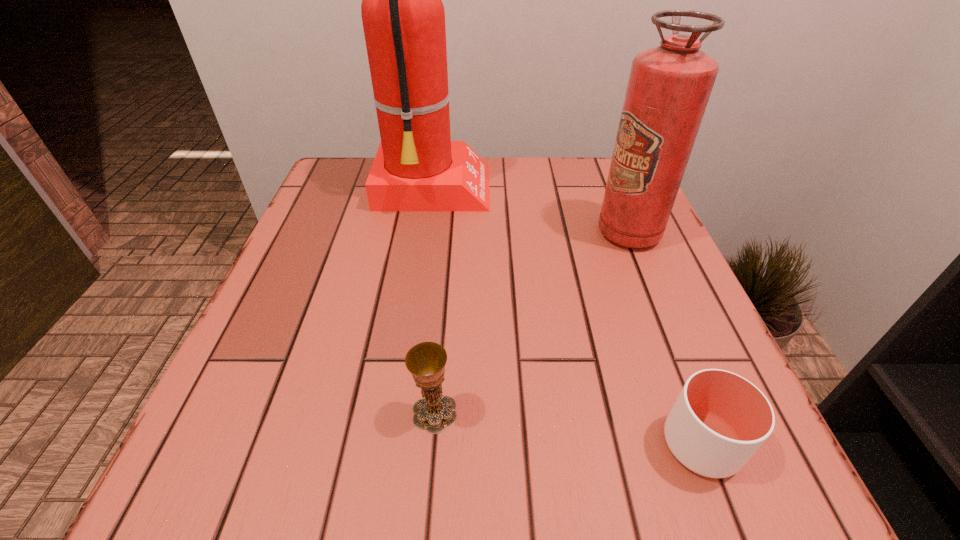
Where is `empty space between the taller fire extinguisher and the cup`? The image size is (960, 540). empty space between the taller fire extinguisher and the cup is located at coordinates (567, 318).

Identify the location of vacant region between the second tallest object and the third tallest object. The image size is (960, 540). (532, 322).

The width and height of the screenshot is (960, 540). I want to click on empty location between the third shortest object and the tallest object, so click(531, 212).

The height and width of the screenshot is (540, 960). I want to click on free area in between the taller fire extinguisher and the shorter fire extinguisher, so click(x=531, y=212).

Identify the location of vacant area that lies between the shorter fire extinguisher and the chalice. (532, 322).

Choose which object is the second nearest neighbor to the right fire extinguisher. Please provide its 2D coordinates. Your answer should be formatted as a tuple, i.e. [(x, y)], where the tuple contains the x and y coordinates of a point satisfying the conditions above.

[(720, 419)]

Select which object is the closest to the shortest object. Please provide its 2D coordinates. Your answer should be formatted as a tuple, i.e. [(x, y)], where the tuple contains the x and y coordinates of a point satisfying the conditions above.

[(426, 361)]

Locate an element on the screen. The width and height of the screenshot is (960, 540). vacant space that satisfies the following two spatial constraints: 1. on the front-facing side of the third tallest object; 2. on the right side of the taller fire extinguisher is located at coordinates (401, 412).

The image size is (960, 540). In order to click on free space that satisfies the following two spatial constraints: 1. on the label side of the shorter fire extinguisher; 2. on the front side of the second shortest object in this screenshot , I will do `click(702, 412)`.

Where is `vacant position in the image that satisfies the following two spatial constraints: 1. on the label side of the right fire extinguisher; 2. on the front side of the chalice`? vacant position in the image that satisfies the following two spatial constraints: 1. on the label side of the right fire extinguisher; 2. on the front side of the chalice is located at coordinates (702, 412).